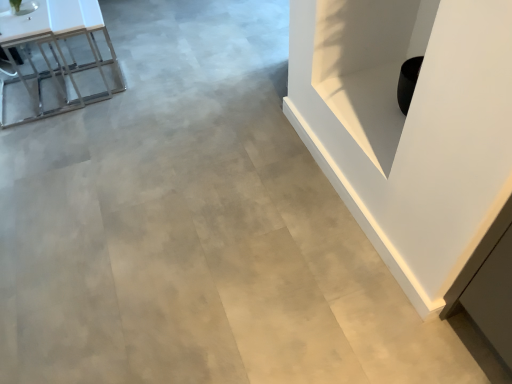
The width and height of the screenshot is (512, 384). What do you see at coordinates (56, 60) in the screenshot?
I see `metallic silver chair at left` at bounding box center [56, 60].

Find the location of a particular element. The height and width of the screenshot is (384, 512). metallic silver chair at left is located at coordinates (56, 60).

In order to face metallic silver chair at left, should I rotate leftwards or rightwards?

Rotate left and turn 28.816 degrees.

At what (x,y) coordinates should I click in order to perform the action: click on metallic silver chair at left. Please return your answer as a coordinate pair (x, y). This screenshot has width=512, height=384. Looking at the image, I should click on (56, 60).